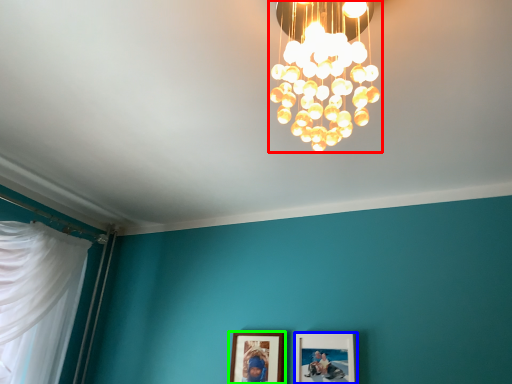
Question: Estimate the real-world distances between objects in this image. Which object is farther from lamp (highlighted by a red box), picture frame (highlighted by a blue box) or picture frame (highlighted by a green box)?

Choices:
 (A) picture frame
 (B) picture frame

Answer: (B)